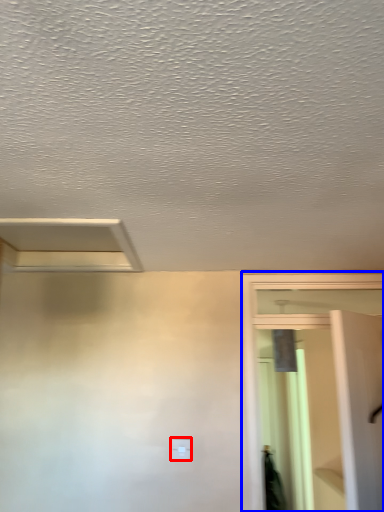
Question: Which of the following is the closest to the observer, light switch (highlighted by a red box) or screen door (highlighted by a blue box)?

Choices:
 (A) light switch
 (B) screen door

Answer: (B)